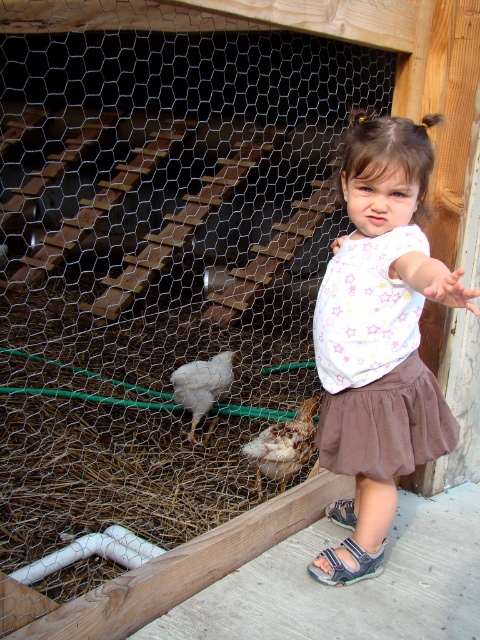
You are a parent trying to ensure your child stays safe while interacting with the chickens. The speckled feathered chicken at center and the blue fabric sandal at lower center are in the scene. Which object is larger and could potentially block the sandal from being easily seen by the child?

The speckled feathered chicken at center is bigger than the blue fabric sandal at lower center, so it could potentially block the sandal from being easily seen by the child.